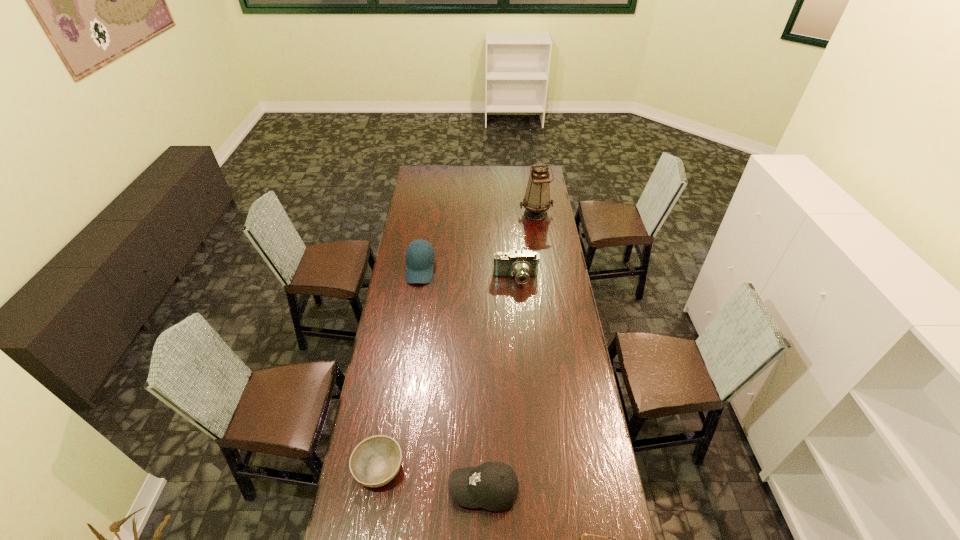
At what (x,y) coordinates should I click in order to perform the action: click on the tallest object. Please return your answer as a coordinate pair (x, y). Image resolution: width=960 pixels, height=540 pixels. Looking at the image, I should click on (536, 202).

The height and width of the screenshot is (540, 960). Identify the location of oil lamp. (536, 202).

This screenshot has height=540, width=960. What are the coordinates of `the taller baseball cap` in the screenshot? It's located at (419, 266).

What are the coordinates of `the farther baseball cap` in the screenshot? It's located at (419, 266).

At what (x,y) coordinates should I click in order to perform the action: click on camcorder. Please return your answer as a coordinate pair (x, y). This screenshot has height=540, width=960. Looking at the image, I should click on (522, 265).

The image size is (960, 540). I want to click on the right baseball cap, so (493, 485).

You are a GUI agent. You are given a task and a screenshot of the screen. Output one action in this format:
    pyautogui.click(x=<x>, y=<y>)
    Task: Click on the nearer baseball cap
    
    Given the screenshot: What is the action you would take?
    pyautogui.click(x=493, y=485)

The height and width of the screenshot is (540, 960). Identify the location of the fifth tallest object. (375, 461).

Find the location of a particular element. The width and height of the screenshot is (960, 540). vacant space located 0.070m on the front of the tallest object is located at coordinates (539, 230).

Find the location of a particular element. The image size is (960, 540). free space located on the front-facing side of the left baseball cap is located at coordinates (413, 322).